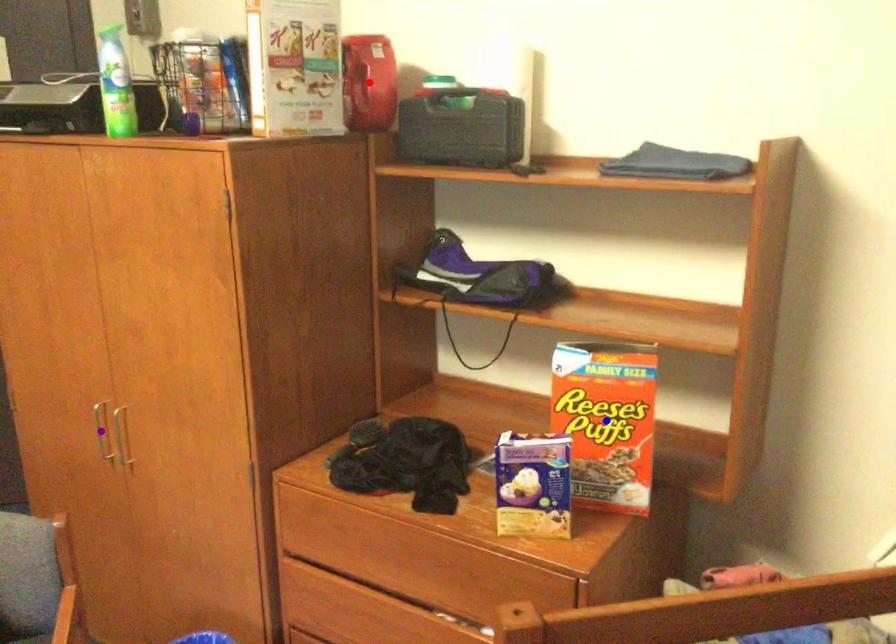
Order these from nearest to farthest:
A) red point
B) blue point
C) purple point

blue point
red point
purple point